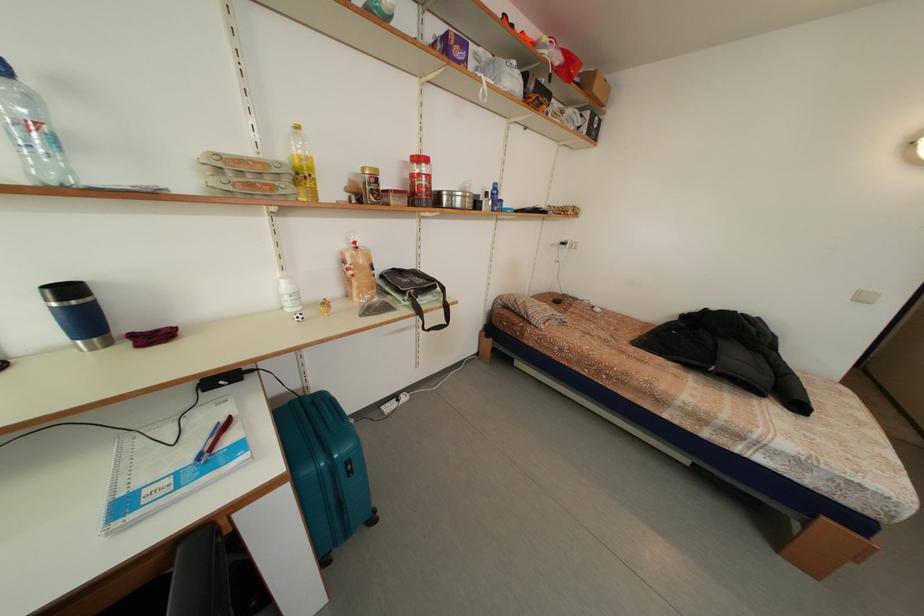
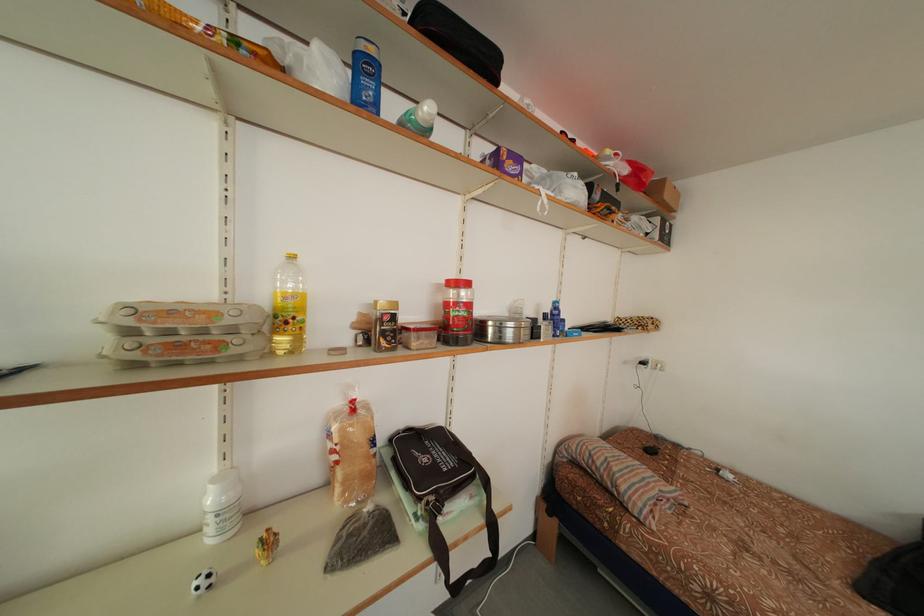
Locate, in the second image, the point that corresponds to [416,309] in the first image.

(429, 531)